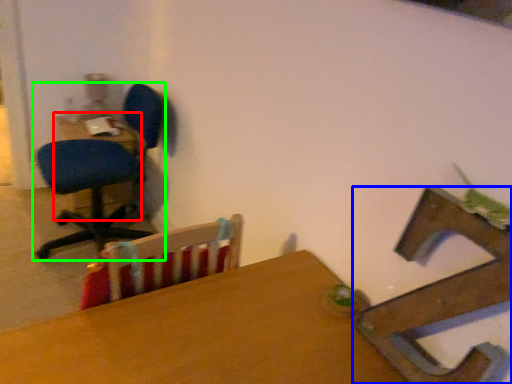
Question: Which object is positioned closest to table (highlighted by a red box)? Select from chair (highlighted by a blue box) and chair (highlighted by a green box).

Choices:
 (A) chair
 (B) chair

Answer: (B)